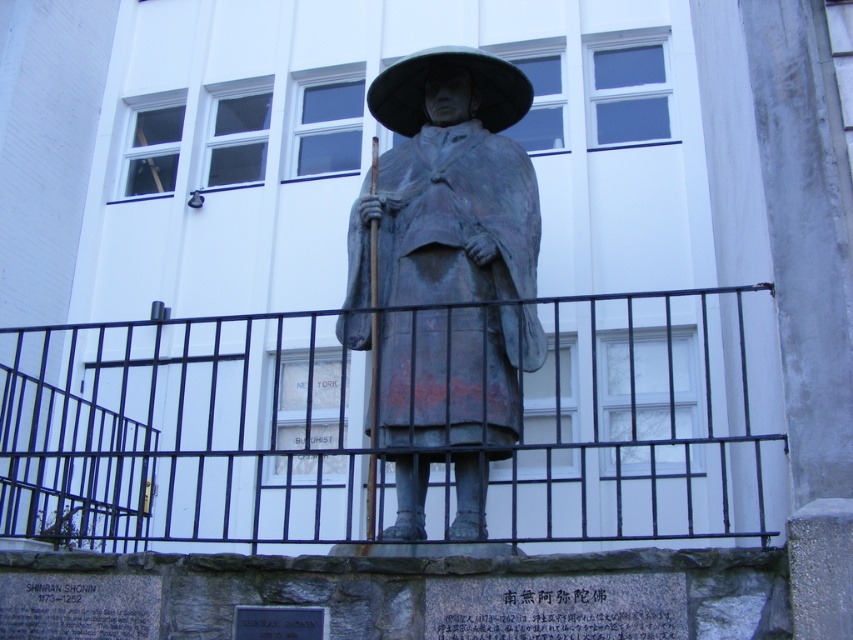
Question: Can you confirm if black metal fence at center is positioned above bronze statue at center?

Choices:
 (A) no
 (B) yes

Answer: (A)

Question: Among these objects, which one is farthest from the camera?

Choices:
 (A) bronze statue at center
 (B) black metal fence at center

Answer: (A)

Question: Does black metal fence at center have a greater width compared to bronze statue at center?

Choices:
 (A) yes
 (B) no

Answer: (A)

Question: Which point is farther from the camera taking this photo?

Choices:
 (A) (706, 316)
 (B) (416, 392)

Answer: (A)

Question: Which of the following is the farthest from the observer?

Choices:
 (A) black metal fence at center
 (B) bronze statue at center

Answer: (B)

Question: Is black metal fence at center smaller than bronze statue at center?

Choices:
 (A) yes
 (B) no

Answer: (B)